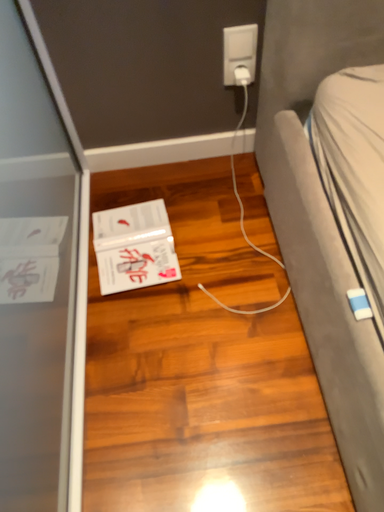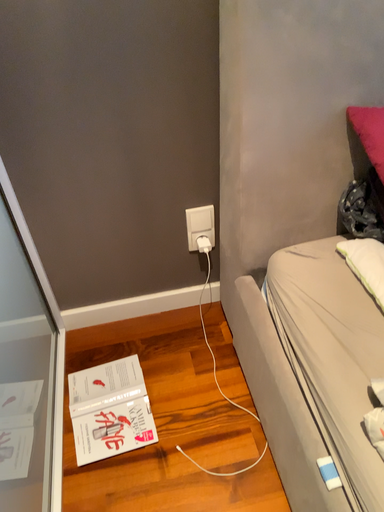
Question: Which way did the camera rotate in the video?

Choices:
 (A) rotated upward
 (B) rotated downward

Answer: (A)